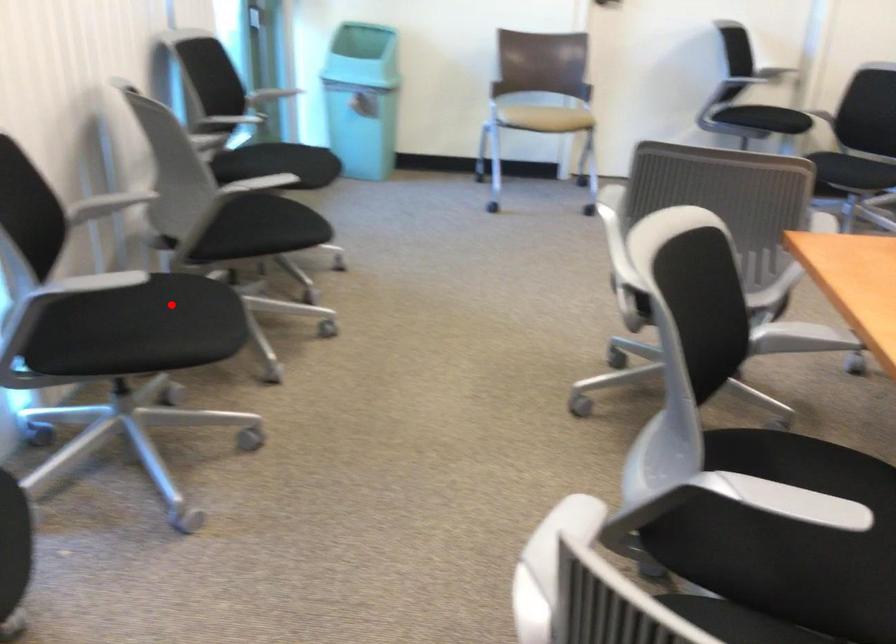
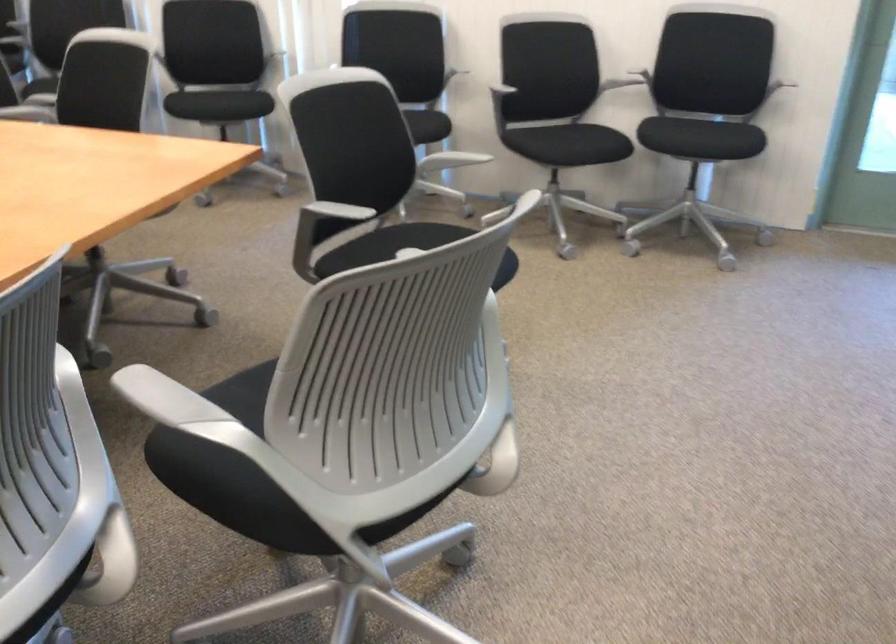
In the second image, find the point that corresponds to the highlighted location in the first image.

(426, 126)